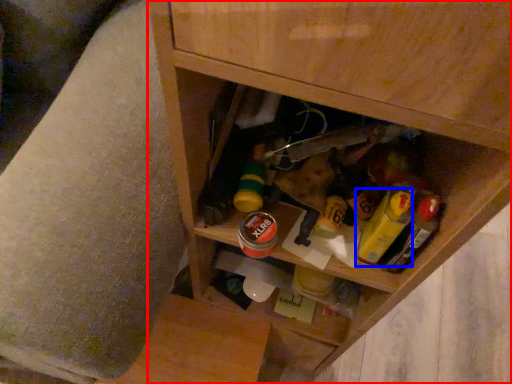
Question: Which point is closer to the camera, cabinetry (highlighted by a red box) or mustard (highlighted by a blue box)?

Choices:
 (A) cabinetry
 (B) mustard

Answer: (A)